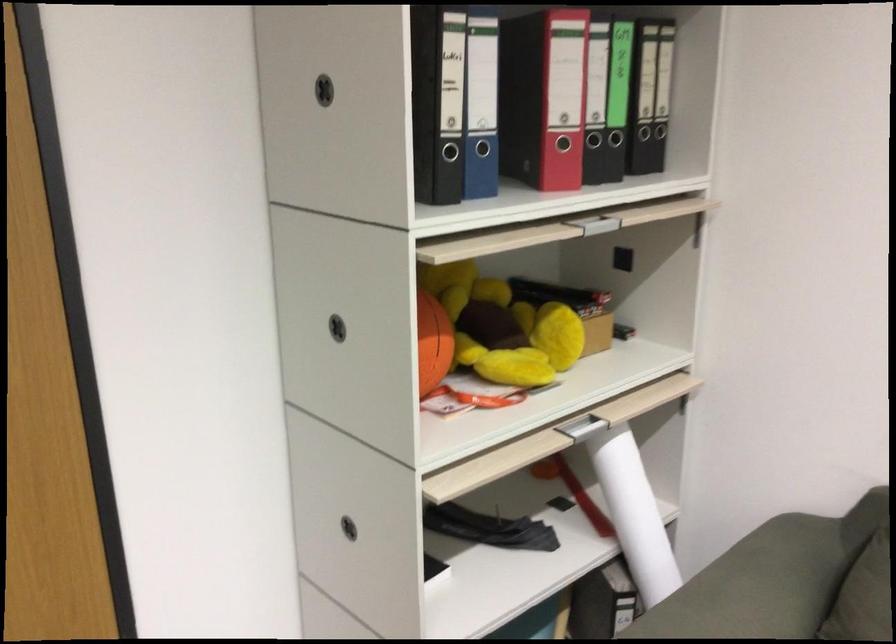
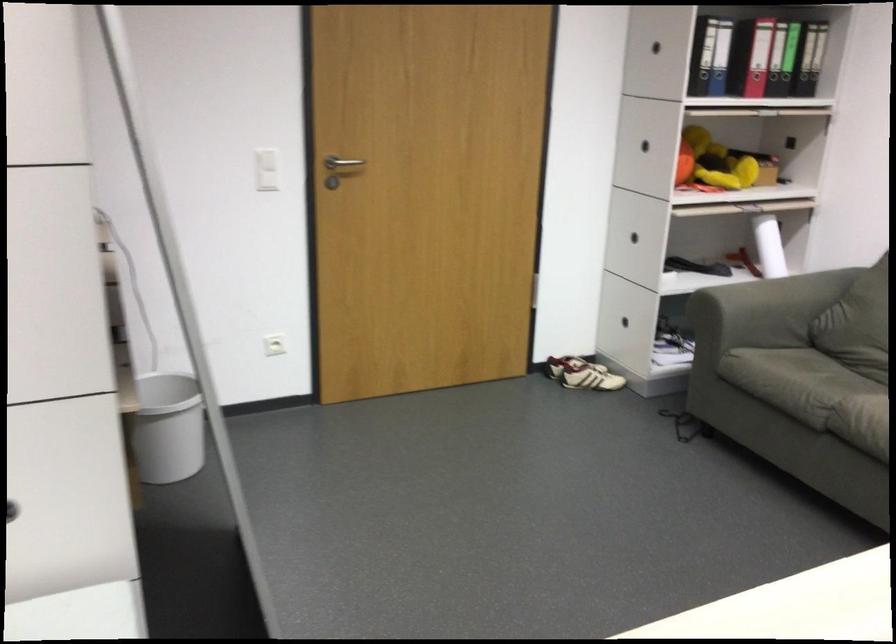
Question: In a continuous first-person perspective shot, in which direction is the camera moving?

Choices:
 (A) Left
 (B) Right
 (C) Forward
 (D) Backward

Answer: (D)